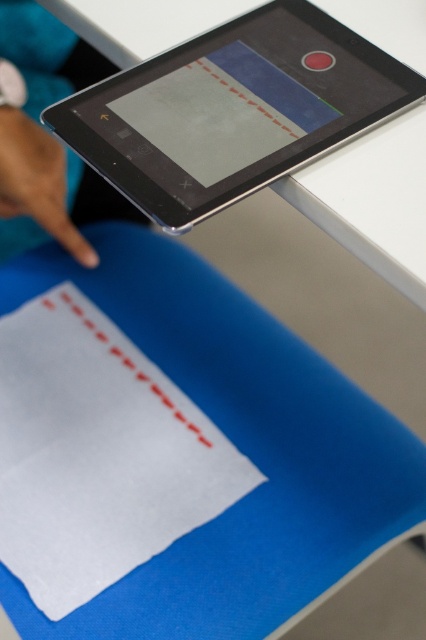
You are an artist who wants to place both the white matte paper at lower left and the matte skin hand at upper left on a shelf. Which object should you place first to ensure they both fit?

The white matte paper at lower left is bigger than the matte skin hand at upper left, so you should place the larger white matte paper at lower left first to ensure both fit on the shelf.

You are an artist trying to trace a design from the tablet onto the paper. Based on the scene, can you confirm if the white matte paper at lower left is placed below the matte black tablet at upper center to serve as a guide?

Yes, the white matte paper at lower left is positioned under the matte black tablet at upper center, allowing the design on the tablet to be used as a guide for tracing onto the paper.

You are a graphic designer who needs to adjust the position of your tools. You have a white matte paper at lower left and a matte black tablet at upper center in front of you. Which object is closer to your face?

The white matte paper at lower left is closer to your face because it is positioned further to the viewer than the matte black tablet at upper center.